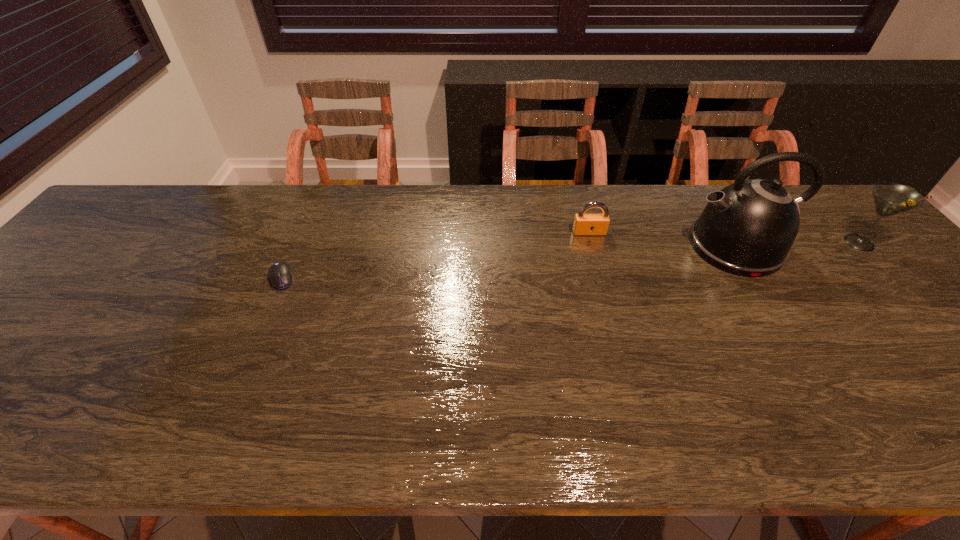
I want to click on vacant area situated 0.220m on the spout of the third object from left to right, so click(x=607, y=247).

Locate an element on the screen. This screenshot has width=960, height=540. free space located 0.310m on the front of the rightmost object is located at coordinates (958, 353).

Locate an element on the screen. blank space located to unlock the padlock from the front is located at coordinates (595, 255).

I want to click on vacant space located 0.230m on the front of the shortest object, so click(242, 369).

Locate an element on the screen. The image size is (960, 540). kettle that is at the far edge is located at coordinates (747, 229).

Identify the location of martini located at the far edge. (890, 198).

Locate an element on the screen. padlock located at the far edge is located at coordinates (584, 224).

What are the coordinates of `object present at the right edge` in the screenshot? It's located at (890, 198).

At what (x,y) coordinates should I click in order to perform the action: click on object situated at the far right corner. Please return your answer as a coordinate pair (x, y). The width and height of the screenshot is (960, 540). Looking at the image, I should click on (890, 198).

You are a GUI agent. You are given a task and a screenshot of the screen. Output one action in this format:
    pyautogui.click(x=<x>, y=<y>)
    Task: Click on the vacant space at the far edge of the desktop
    The width and height of the screenshot is (960, 540).
    Given the screenshot: What is the action you would take?
    pyautogui.click(x=314, y=211)